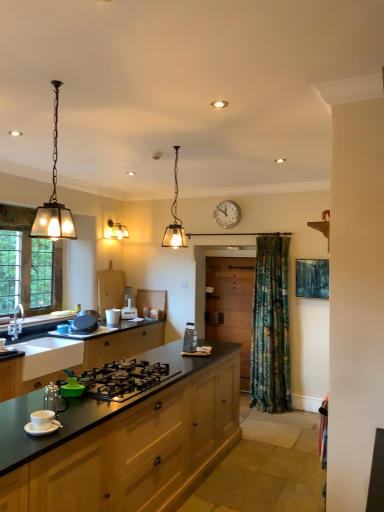
The height and width of the screenshot is (512, 384). What are the coordinates of `empty space that is ontop of matte glass pendant light at upper left, the first lamp viewed from the front` in the screenshot? It's located at (58, 84).